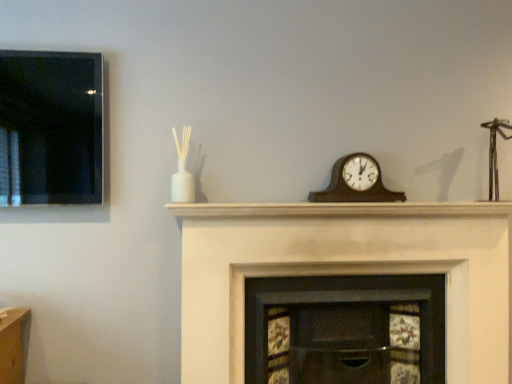
The width and height of the screenshot is (512, 384). Identify the location of vacant space in wooden clock at center (from a real-world perspective). (360, 195).